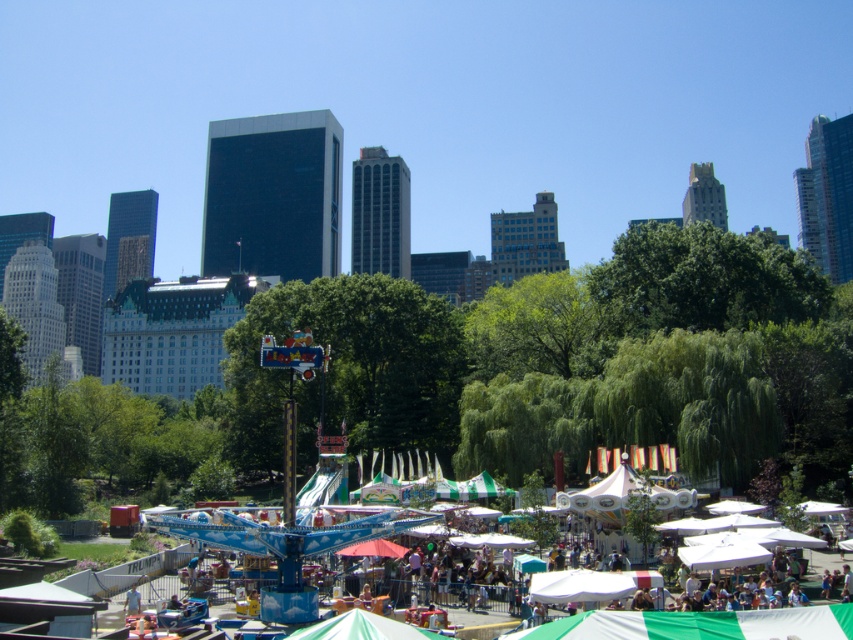
You are at a fair in the park and want to find the taller green fabric canopy. Which one is taller between the green fabric canopy at lower center and the green fabric canopy at center?

The green fabric canopy at center is taller than the green fabric canopy at lower center.

Consider the image. You are standing in the park and want to take a photo of the city skyline. There is a point at coordinates point (x=512, y=637) that is 30.66 meters away from you. If your camera has a maximum zoom range of 25 meters, can you clearly capture the city skyline in your photo?

The point at coordinates point (x=512, y=637) is 30.66 meters away, which exceeds the camera maximum zoom range of 25 meters. Therefore, the city skyline cannot be clearly captured with this camera.

You are standing at the point marked as point (699, 625) in the image. What object are you under?

You are under the green fabric canopy at lower center.